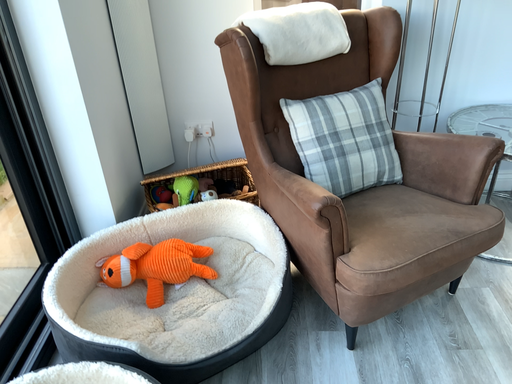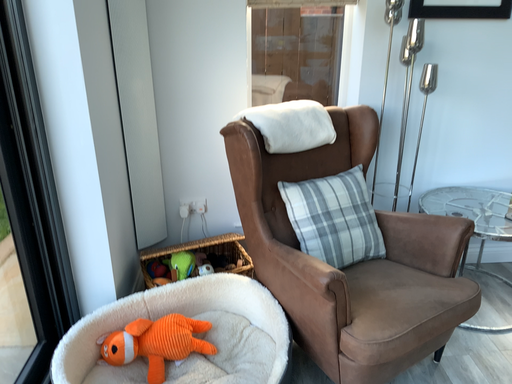
Question: How did the camera likely rotate when shooting the video?

Choices:
 (A) rotated downward
 (B) rotated upward

Answer: (B)